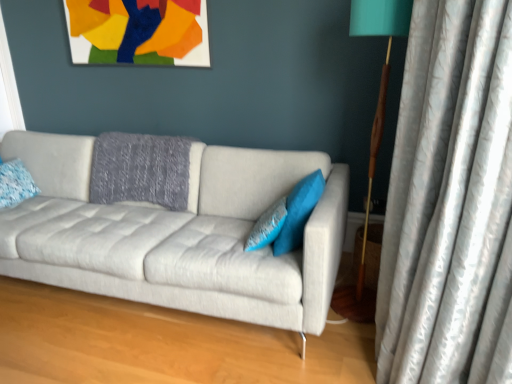
Question: Should I look upward or downward to see matte paper picture frame at upper center?

Choices:
 (A) up
 (B) down

Answer: (A)

Question: Considering the relative positions of light gray fabric couch at center and blue textured pillow at center, the 2th pillow from the left, in the image provided, is light gray fabric couch at center behind blue textured pillow at center, the 2th pillow from the left,?

Choices:
 (A) yes
 (B) no

Answer: (B)

Question: Considering the relative sizes of light gray fabric couch at center and blue textured pillow at center, the second pillow positioned from the right, in the image provided, is light gray fabric couch at center smaller than blue textured pillow at center, the second pillow positioned from the right,?

Choices:
 (A) yes
 (B) no

Answer: (B)

Question: Considering the relative positions of light gray fabric couch at center and blue textured pillow at center, the second pillow positioned from the right, in the image provided, is light gray fabric couch at center to the right of blue textured pillow at center, the second pillow positioned from the right, from the viewer's perspective?

Choices:
 (A) yes
 (B) no

Answer: (B)

Question: From a real-world perspective, is light gray fabric couch at center over blue textured pillow at center, the 2th pillow from the left?

Choices:
 (A) no
 (B) yes

Answer: (A)

Question: Can you see light gray fabric couch at center touching blue textured pillow at center, the second pillow positioned from the right?

Choices:
 (A) no
 (B) yes

Answer: (A)

Question: Is light gray fabric couch at center completely or partially outside of blue textured pillow at center, the second pillow positioned from the right?

Choices:
 (A) no
 (B) yes

Answer: (B)

Question: Considering the relative sizes of teal fabric pillow at center, which is the 1th pillow from right to left, and blue textured pillow at left, the first pillow in the left-to-right sequence, in the image provided, is teal fabric pillow at center, which is the 1th pillow from right to left, wider than blue textured pillow at left, the first pillow in the left-to-right sequence,?

Choices:
 (A) no
 (B) yes

Answer: (B)

Question: Is teal fabric pillow at center, which is the 1th pillow from right to left, positioned behind blue textured pillow at left, the first pillow in the left-to-right sequence?

Choices:
 (A) yes
 (B) no

Answer: (B)

Question: Can you confirm if teal fabric pillow at center, the third pillow from the left, is taller than blue textured pillow at left, the first pillow in the left-to-right sequence?

Choices:
 (A) yes
 (B) no

Answer: (A)

Question: From the image's perspective, does teal fabric pillow at center, which is the 1th pillow from right to left, appear lower than blue textured pillow at left, which is the 3th pillow from right to left?

Choices:
 (A) yes
 (B) no

Answer: (A)

Question: Considering the relative positions of teal fabric pillow at center, which is the 1th pillow from right to left, and blue textured pillow at left, which is the 3th pillow from right to left, in the image provided, is teal fabric pillow at center, which is the 1th pillow from right to left, to the left of blue textured pillow at left, which is the 3th pillow from right to left, from the viewer's perspective?

Choices:
 (A) no
 (B) yes

Answer: (A)

Question: Is teal fabric pillow at center, which is the 1th pillow from right to left, positioned with its back to blue textured pillow at left, the first pillow in the left-to-right sequence?

Choices:
 (A) yes
 (B) no

Answer: (B)

Question: Is blue textured pillow at left, which is the 3th pillow from right to left, shorter than matte paper picture frame at upper center?

Choices:
 (A) no
 (B) yes

Answer: (B)